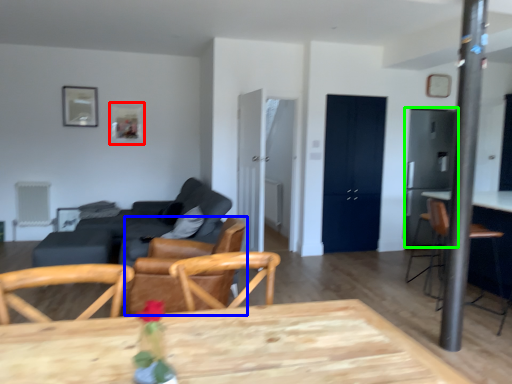
Question: Considering the real-world distances, which object is closest to picture frame (highlighted by a red box)? chair (highlighted by a blue box) or appliance (highlighted by a green box).

Choices:
 (A) chair
 (B) appliance

Answer: (A)